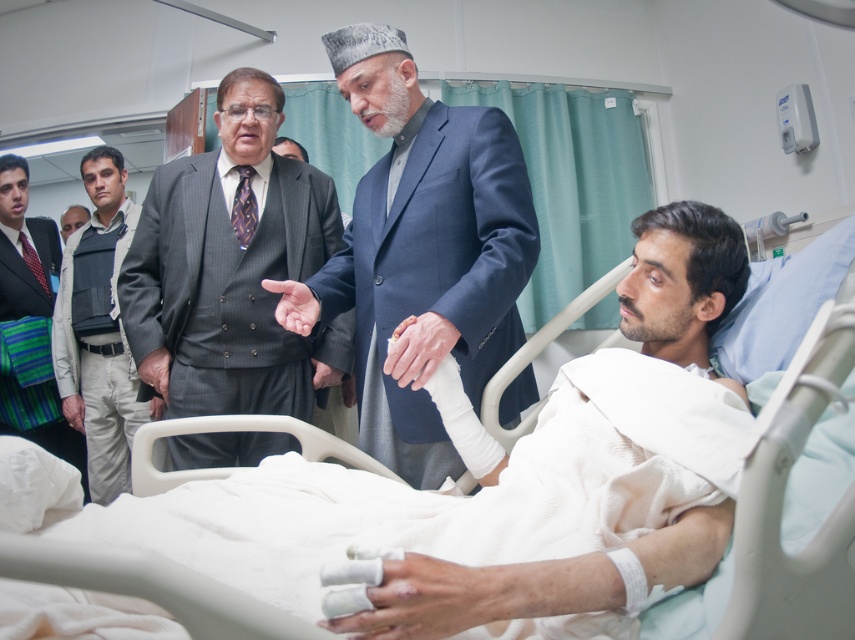
You are a nurse in the hospital ward and need to locate two specific points in the image for a medical procedure. The points are labeled as point 1 at coordinates [59,364] and point 2 at [43,317]. Which point is closer to you?

Point 1 at coordinates [59,364] is closer to you than point 2 at [43,317].

You are a nurse in the hospital ward and need to check the patient. You see the gray pinstripe suit at center and the white bandaged arm at center. Which object is larger in size?

The gray pinstripe suit at center is bigger than the white bandaged arm at center.